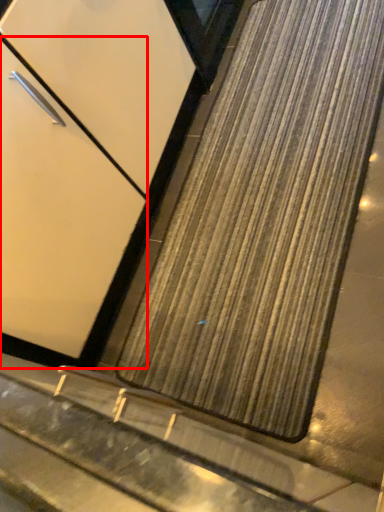
Question: From the image, what is the correct spatial relationship of door (annotated by the red box) in relation to mat?

Choices:
 (A) right
 (B) left

Answer: (B)